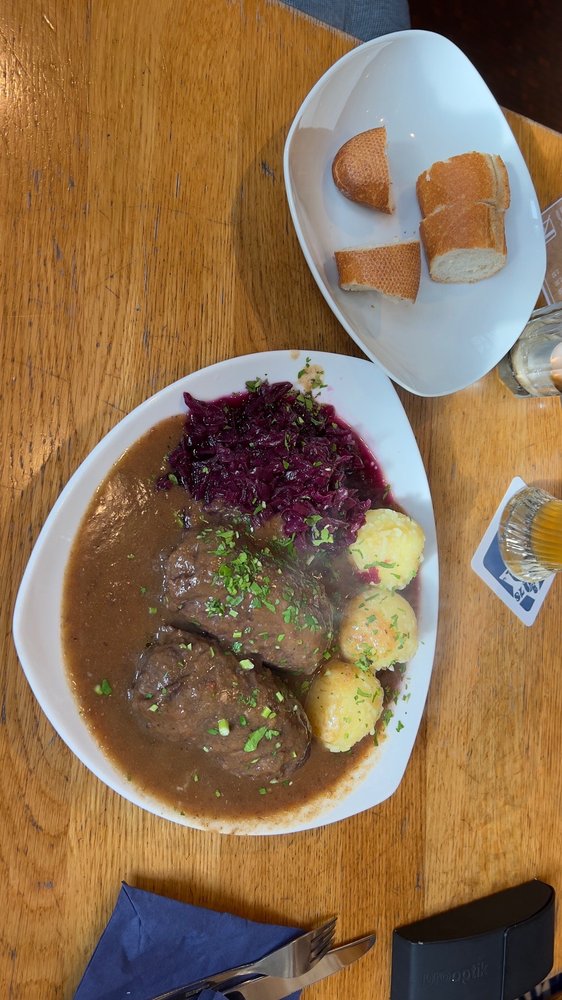
Where is `butter knife`? The width and height of the screenshot is (562, 1000). butter knife is located at coordinates (343, 953).